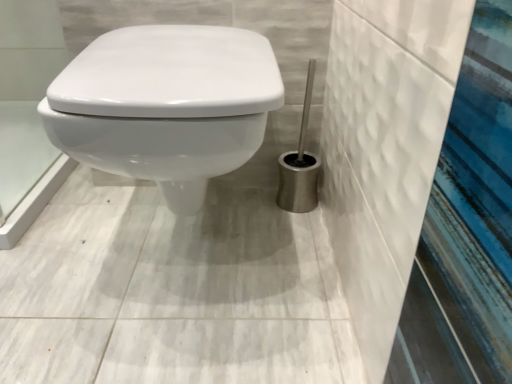
Identify the location of white glossy toilet at center. This screenshot has width=512, height=384. (166, 105).

What do you see at coordinates (166, 105) in the screenshot?
I see `white glossy toilet at center` at bounding box center [166, 105].

Where is `white glossy toilet at center`? This screenshot has width=512, height=384. white glossy toilet at center is located at coordinates (166, 105).